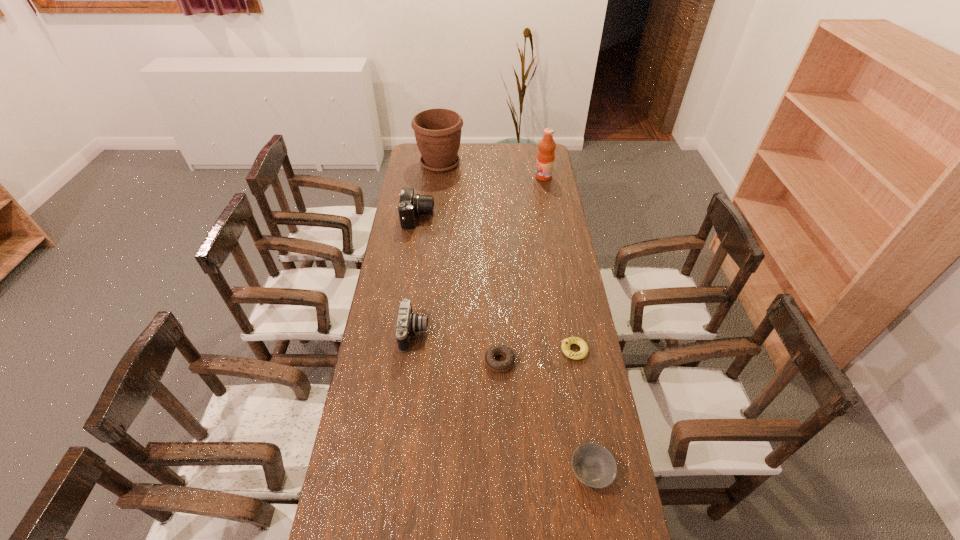
Locate an element on the screen. The width and height of the screenshot is (960, 540). fruit juice is located at coordinates (545, 158).

Locate an element on the screen. The image size is (960, 540). flowerpot is located at coordinates (437, 131).

Locate an element on the screen. The width and height of the screenshot is (960, 540). the farther camera is located at coordinates (410, 205).

At what (x,y) coordinates should I click in order to perform the action: click on the nearer camera. Please return your answer as a coordinate pair (x, y). The image size is (960, 540). Looking at the image, I should click on (408, 322).

Where is `the third shortest object`? The width and height of the screenshot is (960, 540). the third shortest object is located at coordinates (566, 343).

Find the location of a particular element. the second shortest object is located at coordinates (594, 465).

The height and width of the screenshot is (540, 960). In order to click on bowl in this screenshot , I will do `click(594, 465)`.

Locate an element on the screen. the shortest object is located at coordinates (499, 366).

Where is `doughnut`? The image size is (960, 540). doughnut is located at coordinates (499, 366).

I want to click on blank space located 0.250m on the front label of the fruit juice, so click(487, 177).